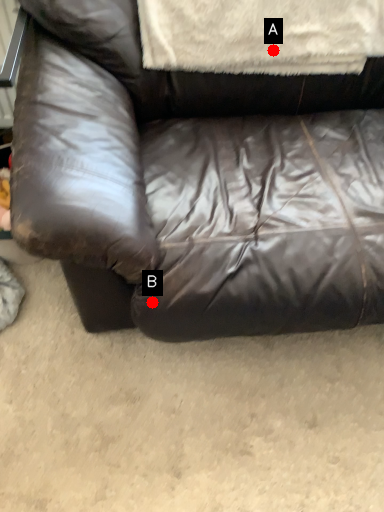
Question: Two points are circled on the image, labeled by A and B beside each circle. Which point appears farthest from the camera in this image?

Choices:
 (A) A is further
 (B) B is further

Answer: (A)